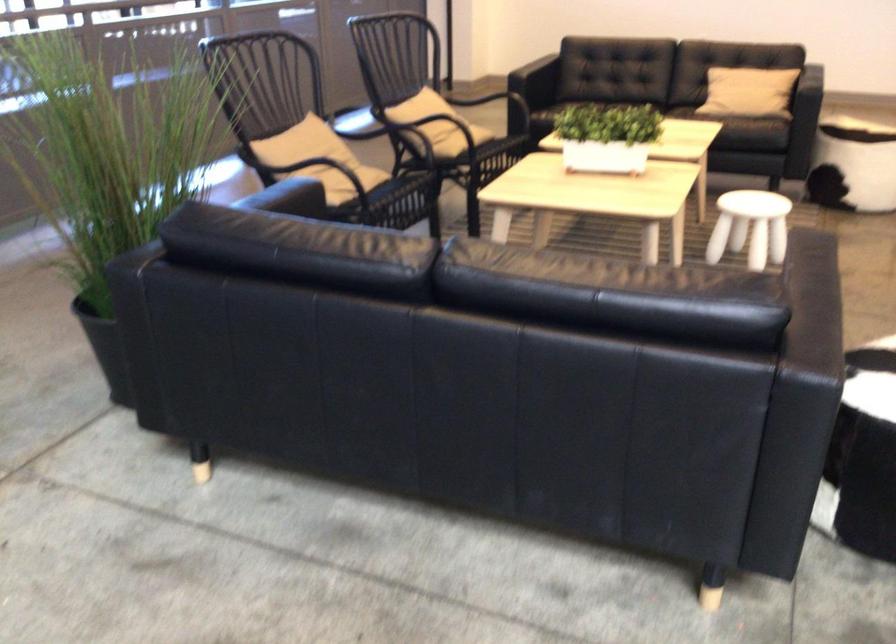
Find the location of a particular element. Image resolution: width=896 pixels, height=644 pixels. black sofa sitting surface is located at coordinates (745, 120).